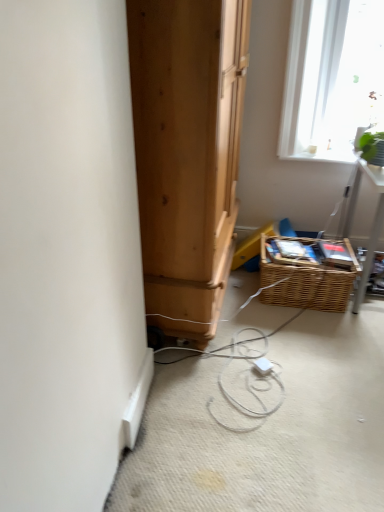
Question: Does white plastic extension cord at center have a lesser width compared to woven brown basket at lower right?

Choices:
 (A) yes
 (B) no

Answer: (A)

Question: Is white plastic extension cord at center surrounding woven brown basket at lower right?

Choices:
 (A) no
 (B) yes

Answer: (A)

Question: Is white plastic extension cord at center turned away from woven brown basket at lower right?

Choices:
 (A) no
 (B) yes

Answer: (A)

Question: From the image's perspective, is white plastic extension cord at center located above woven brown basket at lower right?

Choices:
 (A) no
 (B) yes

Answer: (A)

Question: From a real-world perspective, is white plastic extension cord at center on top of woven brown basket at lower right?

Choices:
 (A) no
 (B) yes

Answer: (A)

Question: Is point (258, 370) positioned closer to the camera than point (377, 156)?

Choices:
 (A) farther
 (B) closer

Answer: (B)

Question: From the image's perspective, is white plastic extension cord at center positioned above or below green leafy plant at upper right?

Choices:
 (A) below
 (B) above

Answer: (A)

Question: In the image, is white plastic extension cord at center on the left side or the right side of green leafy plant at upper right?

Choices:
 (A) left
 (B) right

Answer: (A)

Question: Is white plastic extension cord at center taller or shorter than green leafy plant at upper right?

Choices:
 (A) short
 (B) tall

Answer: (A)

Question: Based on their positions, is white plastic extension cord at center located to the left or right of woven brown basket at lower right?

Choices:
 (A) right
 (B) left

Answer: (B)

Question: Relative to woven brown basket at lower right, is white plastic extension cord at center in front or behind?

Choices:
 (A) front
 (B) behind

Answer: (A)

Question: From a real-world perspective, is white plastic extension cord at center physically located above or below woven brown basket at lower right?

Choices:
 (A) above
 (B) below

Answer: (B)

Question: Is white plastic extension cord at center wider or thinner than woven brown basket at lower right?

Choices:
 (A) thin
 (B) wide

Answer: (A)

Question: Looking at their shapes, would you say green leafy plant at upper right is wider or thinner than white plastic extension cord at center?

Choices:
 (A) thin
 (B) wide

Answer: (B)

Question: From a real-world perspective, is green leafy plant at upper right positioned above or below white plastic extension cord at center?

Choices:
 (A) above
 (B) below

Answer: (A)